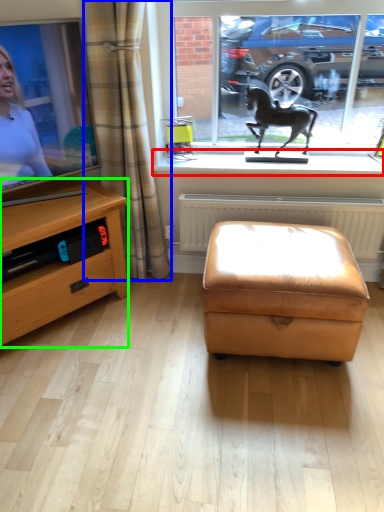
Question: Based on their relative distances, which object is farther from window sill (highlighted by a red box)? Choose from curtain (highlighted by a blue box) and desk (highlighted by a green box).

Choices:
 (A) curtain
 (B) desk

Answer: (B)